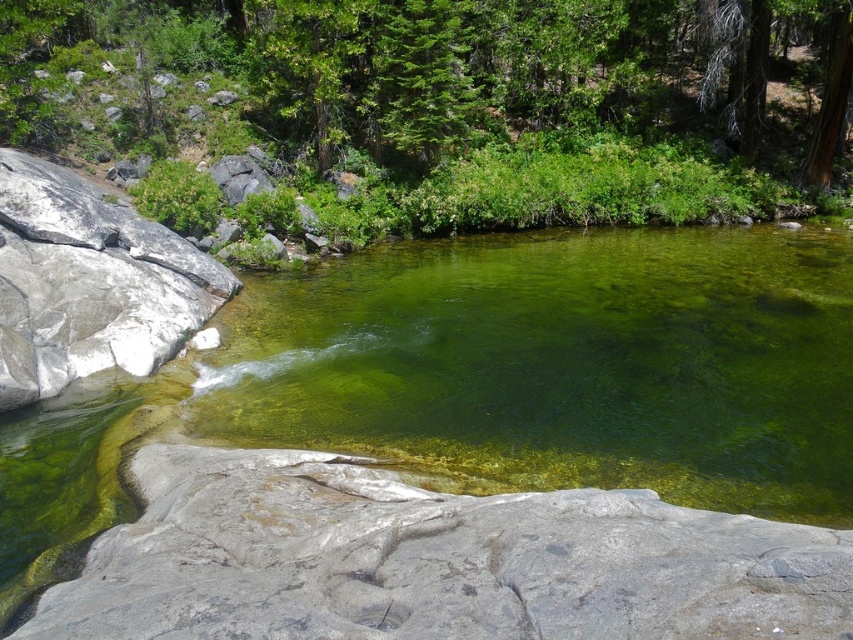
Looking at this image, you are standing at the edge of the stream and want to place two markers at point (648, 468) and point (549, 593). Which marker will be closer to your current position?

Point (648, 468) is further to the viewer than point (549, 593), so the marker at point (549, 593) will be closer to your current position.

You are standing at the edge of the stream and see two points in the scene. The first point is at coordinates point (720, 369) and the second is at point (128, 216). Which point is closer to you?

Point (720, 369) is closer to the viewer than point (128, 216).